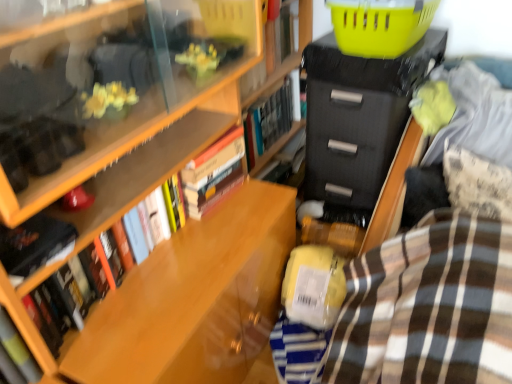
Question: Would you say brown striped blanket at lower right is outside hardcover book at upper center, acting as the 4th book starting from the front?

Choices:
 (A) no
 (B) yes

Answer: (B)

Question: Considering the relative sizes of brown striped blanket at lower right and hardcover book at upper center, the second book in the back-to-front sequence, in the image provided, is brown striped blanket at lower right smaller than hardcover book at upper center, the second book in the back-to-front sequence,?

Choices:
 (A) no
 (B) yes

Answer: (A)

Question: Can hardcover book at upper center, the second book in the back-to-front sequence, be found inside brown striped blanket at lower right?

Choices:
 (A) no
 (B) yes

Answer: (A)

Question: Is brown striped blanket at lower right behind hardcover book at upper center, acting as the 4th book starting from the front?

Choices:
 (A) no
 (B) yes

Answer: (A)

Question: Does brown striped blanket at lower right appear on the right side of hardcover book at upper center, acting as the 4th book starting from the front?

Choices:
 (A) no
 (B) yes

Answer: (B)

Question: From a real-world perspective, is hardcover book at upper center, acting as the 4th book starting from the front, physically located above or below hardcover book at lower left, the fifth book from the back?

Choices:
 (A) above
 (B) below

Answer: (A)

Question: From their relative heights in the image, would you say hardcover book at upper center, the second book in the back-to-front sequence, is taller or shorter than hardcover book at lower left, the 1th book in the front-to-back sequence?

Choices:
 (A) tall
 (B) short

Answer: (B)

Question: Considering the positions of point (294, 62) and point (39, 372), is point (294, 62) closer or farther from the camera than point (39, 372)?

Choices:
 (A) closer
 (B) farther

Answer: (B)

Question: Is hardcover book at upper center, the second book in the back-to-front sequence, in front of or behind hardcover book at lower left, the fifth book from the back, in the image?

Choices:
 (A) front
 (B) behind

Answer: (B)

Question: Is hardcover book at center, the fifth book in the front-to-back sequence, inside the boundaries of brown striped blanket at lower right, or outside?

Choices:
 (A) inside
 (B) outside

Answer: (B)

Question: In terms of width, does hardcover book at center, the fifth book in the front-to-back sequence, look wider or thinner when compared to brown striped blanket at lower right?

Choices:
 (A) thin
 (B) wide

Answer: (A)

Question: Visually, is hardcover book at center, the 1th book when ordered from back to front, positioned to the left or to the right of brown striped blanket at lower right?

Choices:
 (A) right
 (B) left

Answer: (B)

Question: Does point (287, 137) appear closer or farther from the camera than point (490, 271)?

Choices:
 (A) farther
 (B) closer

Answer: (A)

Question: Looking at their shapes, would you say yellow plastic basket at upper right is wider or thinner than hardcover book at center, the 1th book when ordered from back to front?

Choices:
 (A) wide
 (B) thin

Answer: (A)

Question: Is yellow plastic basket at upper right bigger or smaller than hardcover book at center, the 1th book when ordered from back to front?

Choices:
 (A) big
 (B) small

Answer: (A)